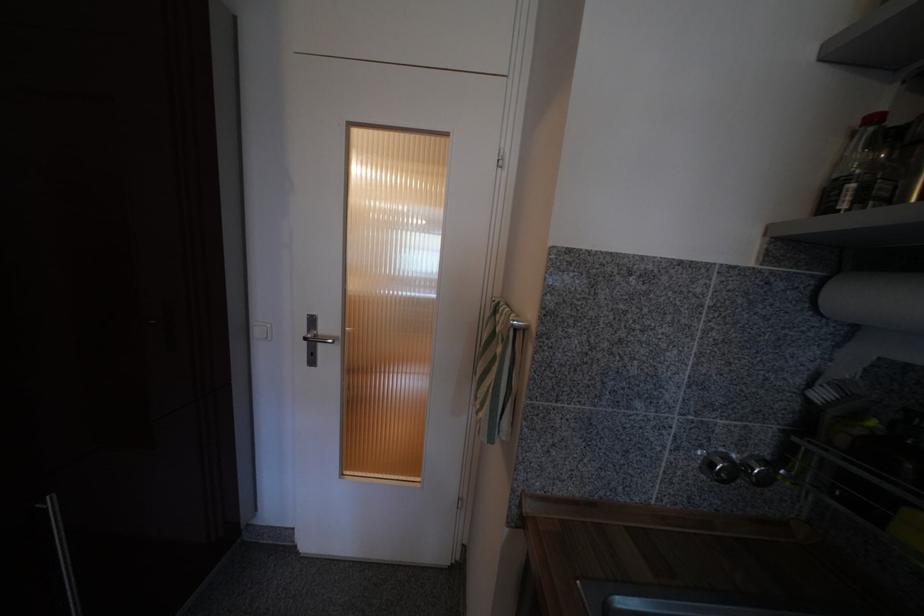
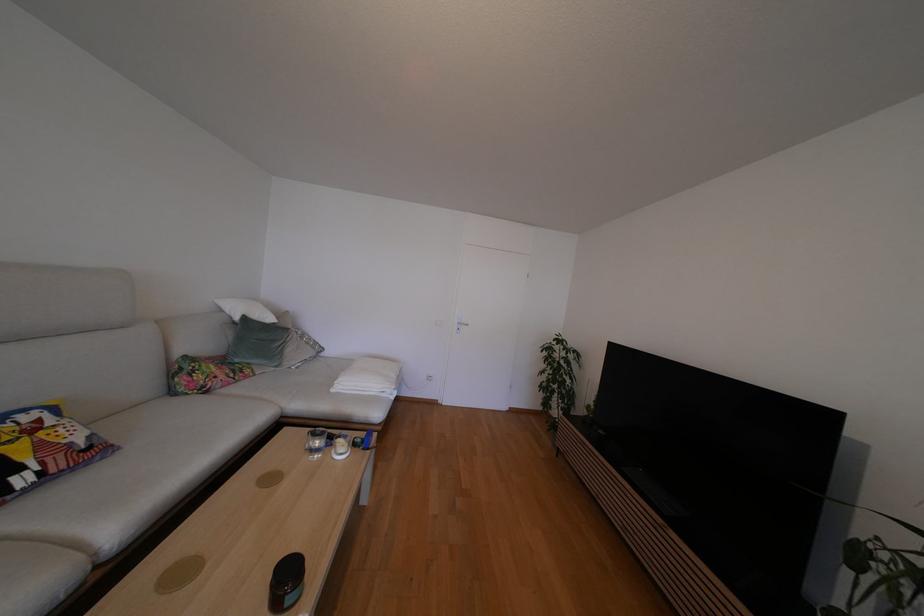
What movement of the cameraman would produce the second image?

The movement direction of the cameraman is left, backward.